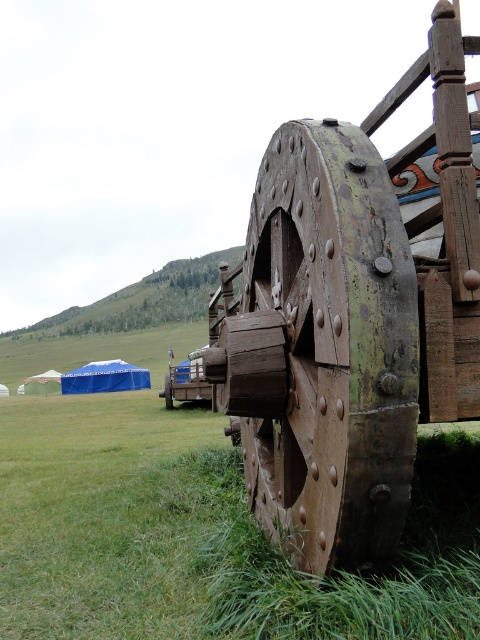
Question: Is blue fabric tent at lower left positioned behind white fabric tent at lower left?

Choices:
 (A) yes
 (B) no

Answer: (B)

Question: Is rusty wood wheel at center behind blue fabric tent at lower left?

Choices:
 (A) no
 (B) yes

Answer: (A)

Question: Which object is the closest to the wooden wheel at lower right?

Choices:
 (A) rusty wood wheel at center
 (B) white fabric tent at lower left
 (C) blue fabric tent at lower left

Answer: (C)

Question: Which point is closer to the camera?

Choices:
 (A) (54, 372)
 (B) (166, 403)
 (C) (304, 413)
 (D) (122, 364)

Answer: (C)

Question: Which is nearer to the blue fabric tent at lower left?

Choices:
 (A) rusty wood wheel at center
 (B) wooden wheel at lower right

Answer: (B)

Question: Does rusty wood wheel at center appear over wooden wheel at lower right?

Choices:
 (A) yes
 (B) no

Answer: (A)